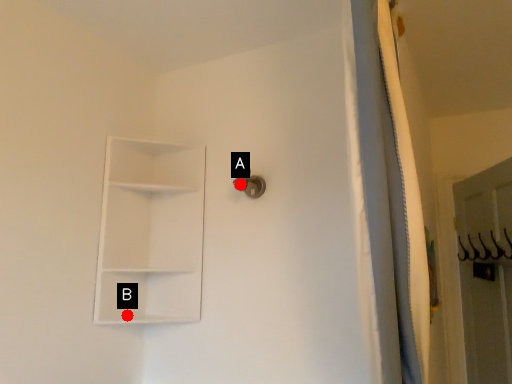
Question: Two points are circled on the image, labeled by A and B beside each circle. Among these points, which one is nearest to the camera?

Choices:
 (A) A is closer
 (B) B is closer

Answer: (B)